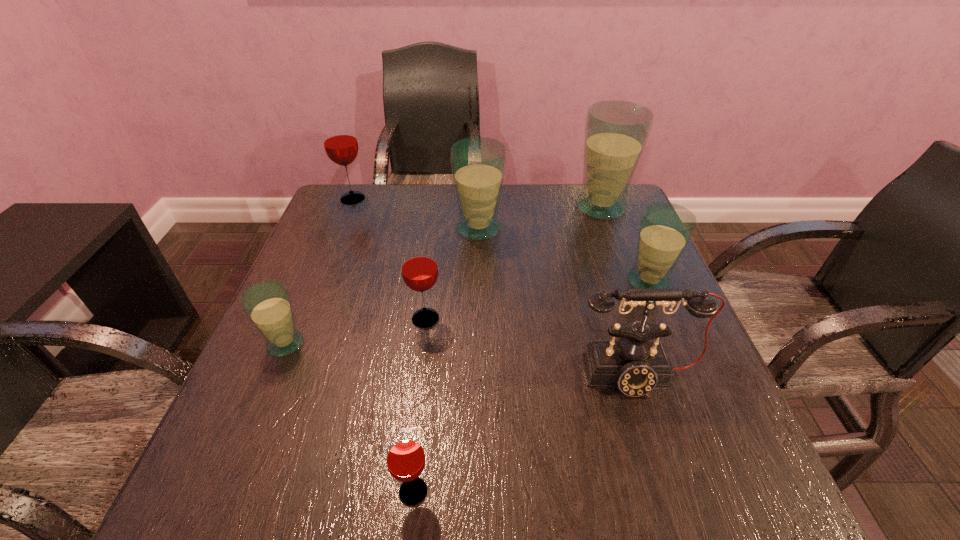
This screenshot has width=960, height=540. I want to click on the tallest object, so click(616, 132).

At what (x,y) coordinates should I click in order to perform the action: click on the biggest blue glass. Please return your answer as a coordinate pair (x, y). Looking at the image, I should click on (616, 132).

You are a GUI agent. You are given a task and a screenshot of the screen. Output one action in this format:
    pyautogui.click(x=<x>, y=<y>)
    Task: Click on the farthest red glass
    The height and width of the screenshot is (540, 960).
    Given the screenshot: What is the action you would take?
    pyautogui.click(x=340, y=143)

The width and height of the screenshot is (960, 540). I want to click on the leftmost red glass, so click(x=340, y=143).

This screenshot has height=540, width=960. What are the coordinates of `the third glass from right to left` in the screenshot? It's located at (478, 164).

Locate an element on the screen. The width and height of the screenshot is (960, 540). the fourth object from right to left is located at coordinates (478, 164).

Where is `telephone`? This screenshot has height=540, width=960. telephone is located at coordinates pyautogui.click(x=635, y=364).

Locate an element on the screen. The image size is (960, 540). the second farthest red glass is located at coordinates (419, 268).

In order to click on the third biggest blue glass in this screenshot , I will do `click(665, 229)`.

Identify the location of the third farthest blue glass. The width and height of the screenshot is (960, 540). (665, 229).